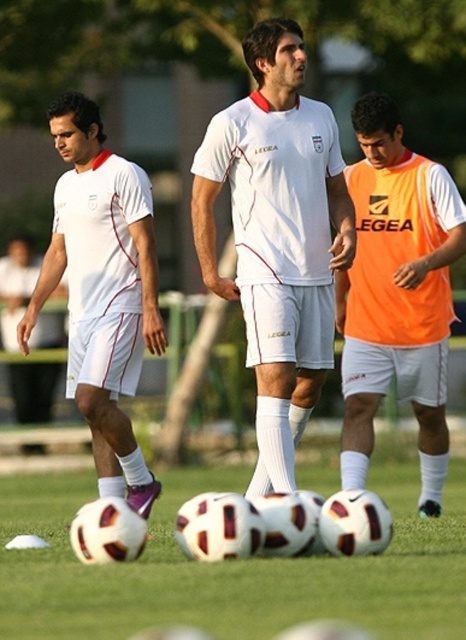
Describe the element at coordinates (228, 568) in the screenshot. I see `white matte soccer balls at center` at that location.

This screenshot has width=466, height=640. What are the coordinates of `white matte soccer balls at center` in the screenshot? It's located at (228, 568).

Does point (189, 483) lie behind point (59, 109)?

Yes, it is behind point (59, 109).

Who is shorter, white matte soccer balls at center or matte white shorts at left?

white matte soccer balls at center is shorter.

The width and height of the screenshot is (466, 640). I want to click on white matte soccer balls at center, so click(228, 568).

Is white matte jersey at center further to the viewer compared to matte white shorts at left?

No, white matte jersey at center is in front of matte white shorts at left.

Between white matte jersey at center and matte white shorts at left, which one appears on the right side from the viewer's perspective?

Positioned to the right is white matte jersey at center.

Is point (272, 60) closer to viewer compared to point (66, 182)?

That is True.

Identify the location of white matte jersey at center. The height and width of the screenshot is (640, 466). (278, 236).